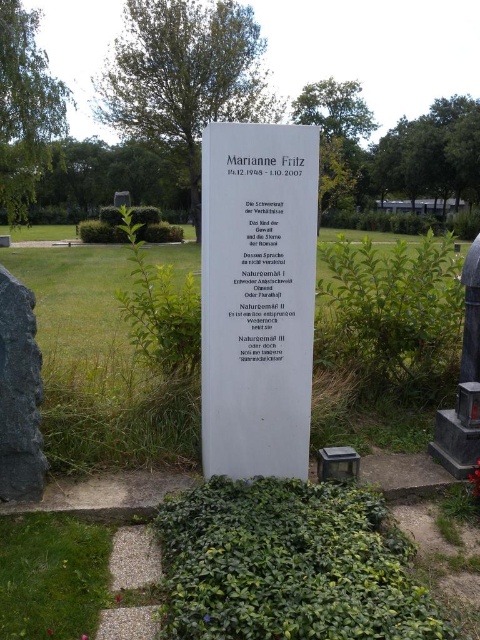
You are standing at the entrance of the cemetery and see the white stone plaque at center. If you walk straight towards it, will you reach it before the pathway ends?

The white stone plaque at center is located at point (x=257, y=298), which is along the pathway leading up to the monument. Since the pathway extends to the monument, walking straight towards the white stone plaque at center will lead you directly to it before the pathway ends.

You are standing in a cemetery and see the white stone plaque at center and the black paper at center. Which object is positioned to the left when facing the memorial?

The white stone plaque at center is to the left of the black paper at center when facing the memorial.